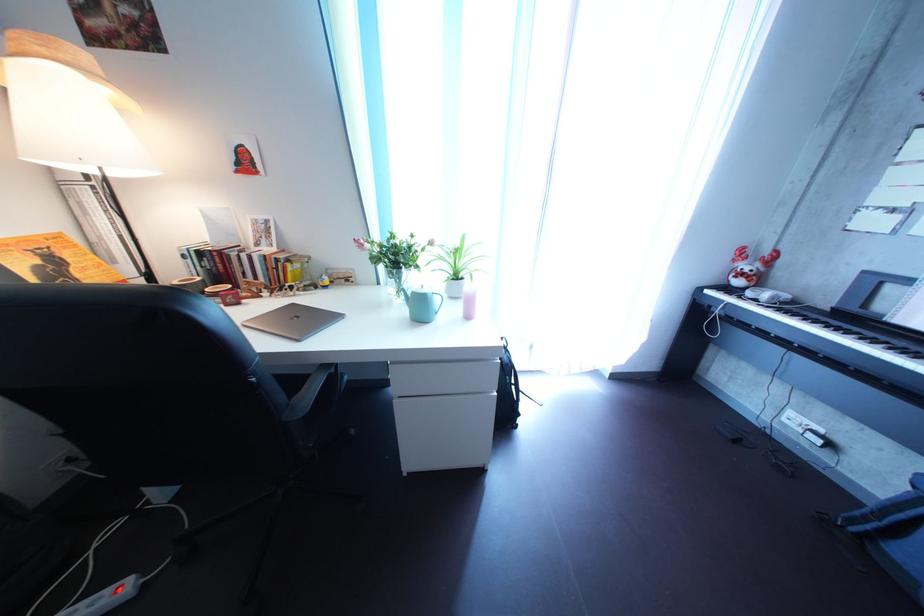
What do you see at coordinates (294, 321) in the screenshot? I see `the closed silver laptop` at bounding box center [294, 321].